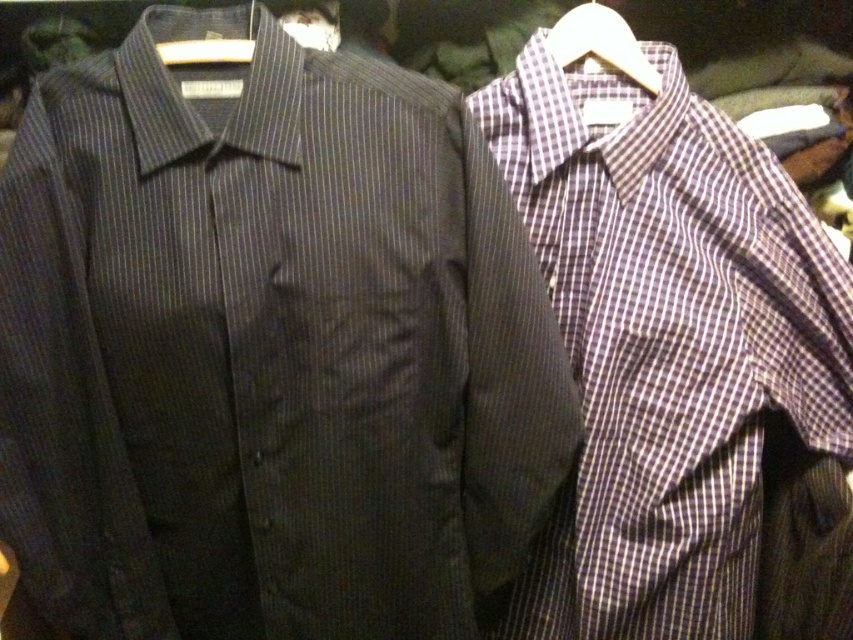
Who is more distant from viewer, (643, 64) or (164, 61)?

Point (643, 64)

Between white plastic hanger at upper right and white plastic hanger at upper center, which one is positioned lower?

white plastic hanger at upper center is lower down.

Is point (567, 58) positioned after point (181, 60)?

Yes, point (567, 58) is farther from viewer.

What are the coordinates of `white plastic hanger at upper right` in the screenshot? It's located at (601, 44).

Is plaid cotton shirt at right shorter than white plastic hanger at upper center?

No, plaid cotton shirt at right is not shorter than white plastic hanger at upper center.

Does point (759, 385) lie in front of point (218, 52)?

That is False.

Find the location of a particular element. The width and height of the screenshot is (853, 640). plaid cotton shirt at right is located at coordinates (665, 340).

How distant is plaid cotton shirt at right from white plastic hanger at upper right?

plaid cotton shirt at right and white plastic hanger at upper right are 27.25 centimeters apart.

Consider the image. Who is taller, plaid cotton shirt at right or white plastic hanger at upper right?

Standing taller between the two is plaid cotton shirt at right.

Does point (575, 332) come in front of point (621, 26)?

No.

Locate an element on the screen. This screenshot has height=640, width=853. plaid cotton shirt at right is located at coordinates (665, 340).